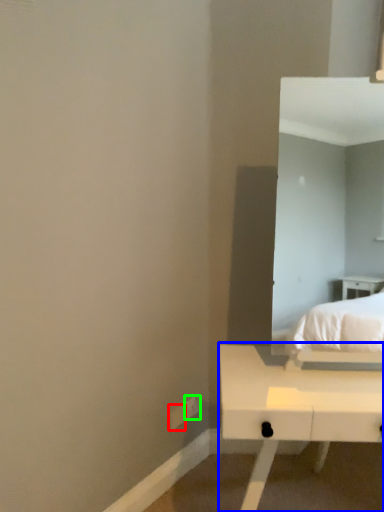
Question: Based on their relative distances, which object is farther from electric outlet (highlighted by a red box)? Choose from table (highlighted by a blue box) and electric outlet (highlighted by a green box).

Choices:
 (A) table
 (B) electric outlet

Answer: (A)